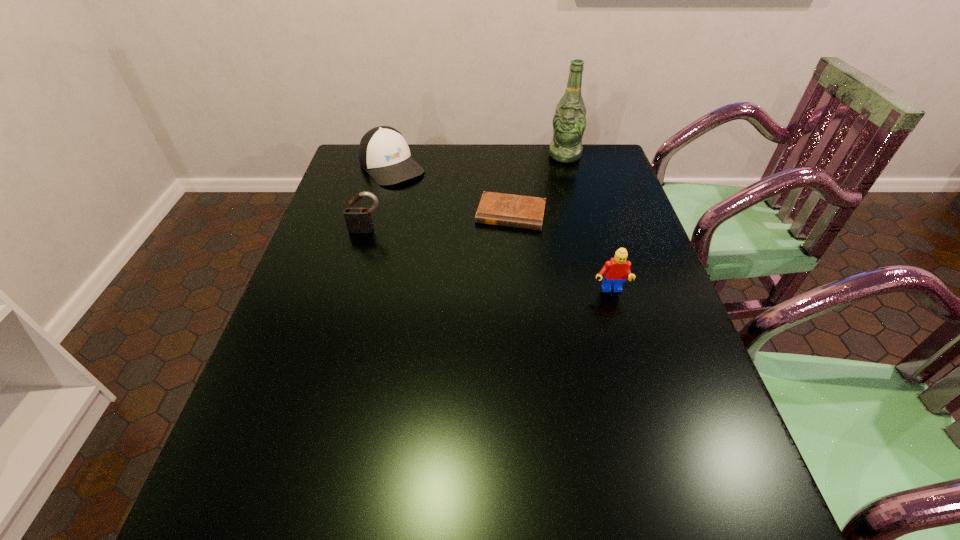
You are a GUI agent. You are given a task and a screenshot of the screen. Output one action in this format:
    pyautogui.click(x=<x>, y=<y>)
    Task: Click on the cap that is positioned at the left edge
    This screenshot has height=540, width=960.
    Given the screenshot: What is the action you would take?
    pyautogui.click(x=384, y=154)

Image resolution: width=960 pixels, height=540 pixels. I want to click on Lego present at the right edge, so click(x=615, y=271).

This screenshot has width=960, height=540. I want to click on beer bottle positioned at the right edge, so click(569, 122).

Where is `object present at the far left corner`? The image size is (960, 540). object present at the far left corner is located at coordinates (384, 154).

Locate an element on the screen. object that is at the far right corner is located at coordinates (569, 122).

In the image, there is a desktop. Where is `vacant space at the far edge`? This screenshot has width=960, height=540. vacant space at the far edge is located at coordinates (521, 146).

This screenshot has width=960, height=540. What are the coordinates of `free space at the near edge` in the screenshot? It's located at click(419, 446).

I want to click on vacant space at the left edge of the desktop, so click(x=304, y=343).

Find the location of `free space at the right edge of the desktop`. free space at the right edge of the desktop is located at coordinates (664, 339).

Where is `blank space at the near left corner`? The image size is (960, 540). blank space at the near left corner is located at coordinates (281, 466).